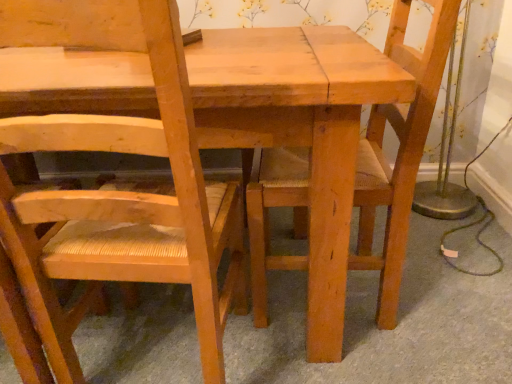
Question: Is natural wood chair at left, the 1th chair when ordered from left to right, looking in the opposite direction of natural wood chair at center, arranged as the 2th chair when viewed from the left?

Choices:
 (A) no
 (B) yes

Answer: (A)

Question: Does natural wood chair at left, the 1th chair when ordered from left to right, turn towards natural wood chair at center, arranged as the 2th chair when viewed from the left?

Choices:
 (A) no
 (B) yes

Answer: (A)

Question: From a real-world perspective, is natural wood chair at left, acting as the 2th chair starting from the right, positioned over natural wood chair at center, which ranks as the 1th chair in right-to-left order, based on gravity?

Choices:
 (A) no
 (B) yes

Answer: (B)

Question: Considering the relative sizes of natural wood chair at left, acting as the 2th chair starting from the right, and natural wood chair at center, arranged as the 2th chair when viewed from the left, in the image provided, is natural wood chair at left, acting as the 2th chair starting from the right, wider than natural wood chair at center, arranged as the 2th chair when viewed from the left,?

Choices:
 (A) no
 (B) yes

Answer: (A)

Question: Is natural wood chair at center, arranged as the 2th chair when viewed from the left, completely or partially inside natural wood chair at left, acting as the 2th chair starting from the right?

Choices:
 (A) no
 (B) yes

Answer: (A)

Question: From the image's perspective, is natural wood chair at left, acting as the 2th chair starting from the right, located beneath natural wood chair at center, arranged as the 2th chair when viewed from the left?

Choices:
 (A) yes
 (B) no

Answer: (A)

Question: From a real-world perspective, is natural wood chair at center, arranged as the 2th chair when viewed from the left, positioned under natural wood chair at left, acting as the 2th chair starting from the right, based on gravity?

Choices:
 (A) yes
 (B) no

Answer: (A)

Question: From the image's perspective, does natural wood chair at center, arranged as the 2th chair when viewed from the left, appear lower than natural wood chair at left, the 1th chair when ordered from left to right?

Choices:
 (A) no
 (B) yes

Answer: (A)

Question: From a real-world perspective, is natural wood chair at center, which ranks as the 1th chair in right-to-left order, on top of natural wood chair at left, the 1th chair when ordered from left to right?

Choices:
 (A) yes
 (B) no

Answer: (B)

Question: Can we say natural wood chair at center, which ranks as the 1th chair in right-to-left order, lies outside natural wood chair at left, the 1th chair when ordered from left to right?

Choices:
 (A) yes
 (B) no

Answer: (A)

Question: Is natural wood chair at center, arranged as the 2th chair when viewed from the left, to the right of natural wood chair at left, the 1th chair when ordered from left to right, from the viewer's perspective?

Choices:
 (A) yes
 (B) no

Answer: (A)

Question: Does natural wood chair at center, arranged as the 2th chair when viewed from the left, lie in front of natural wood chair at left, acting as the 2th chair starting from the right?

Choices:
 (A) yes
 (B) no

Answer: (B)

Question: From their relative heights in the image, would you say natural wood chair at center, which ranks as the 1th chair in right-to-left order, is taller or shorter than natural wood chair at left, acting as the 2th chair starting from the right?

Choices:
 (A) short
 (B) tall

Answer: (A)